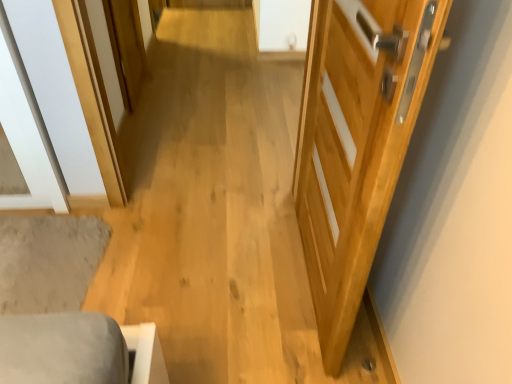
Question: Should I look upward or downward to see natural wood door at right?

Choices:
 (A) up
 (B) down

Answer: (A)